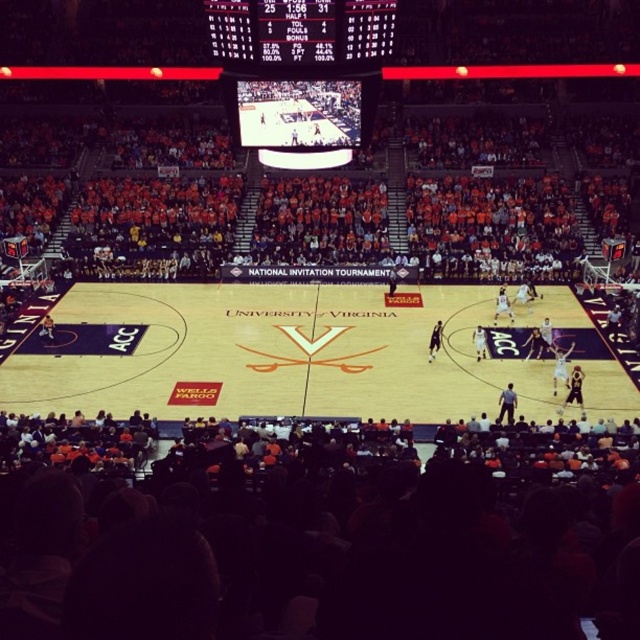
Question: Estimate the real-world distances between objects in this image. Which object is farther from the black glossy scoreboard at upper center?

Choices:
 (A) orange fabric seats at lower center
 (B) wooden basketball court at center

Answer: (B)

Question: Does orange fabric seats at lower center come in front of wooden basketball court at center?

Choices:
 (A) yes
 (B) no

Answer: (A)

Question: Which object appears farthest from the camera in this image?

Choices:
 (A) orange fabric seats at lower center
 (B) wooden basketball court at center
 (C) black plastic scoreboard at upper center
 (D) black glossy scoreboard at upper center

Answer: (B)

Question: Which object appears farthest from the camera in this image?

Choices:
 (A) black plastic scoreboard at upper center
 (B) wooden basketball court at center
 (C) black glossy scoreboard at upper center
 (D) orange fabric seats at lower center

Answer: (B)

Question: Is wooden basketball court at center closer to camera compared to black plastic scoreboard at upper center?

Choices:
 (A) no
 (B) yes

Answer: (A)

Question: Where is orange fabric seats at lower center located in relation to wooden basketball court at center in the image?

Choices:
 (A) right
 (B) left

Answer: (B)